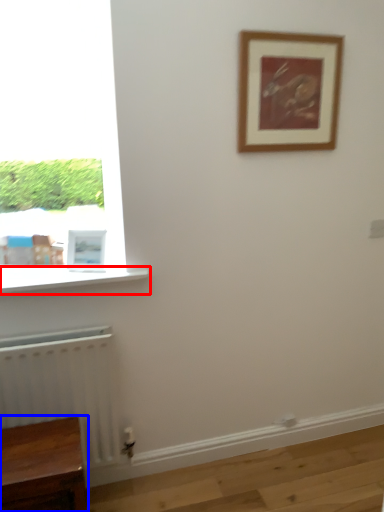
Question: Among these objects, which one is farthest to the camera, window sill (highlighted by a red box) or furniture (highlighted by a blue box)?

Choices:
 (A) window sill
 (B) furniture

Answer: (A)